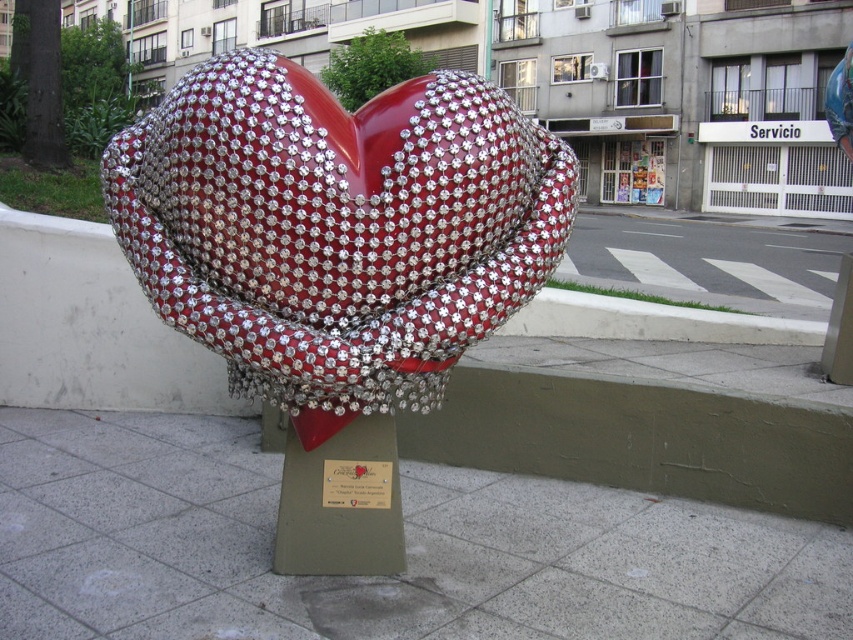
Question: Among these objects, which one is farthest from the camera?

Choices:
 (A) green concrete curb at center
 (B) white tile pavement at center
 (C) metallic plaque at center

Answer: (A)

Question: Does shiny metallic heart at center appear under green concrete curb at center?

Choices:
 (A) yes
 (B) no

Answer: (B)

Question: Which object appears closest to the camera in this image?

Choices:
 (A) metallic plaque at center
 (B) white tile pavement at center

Answer: (B)

Question: Is shiny metallic heart at center to the left of white tile pavement at center from the viewer's perspective?

Choices:
 (A) no
 (B) yes

Answer: (A)

Question: Which object is positioned closest to the shiny metallic heart at center?

Choices:
 (A) green concrete curb at center
 (B) white tile pavement at center

Answer: (B)

Question: Can you confirm if shiny metallic heart at center is positioned below white tile pavement at center?

Choices:
 (A) no
 (B) yes

Answer: (A)